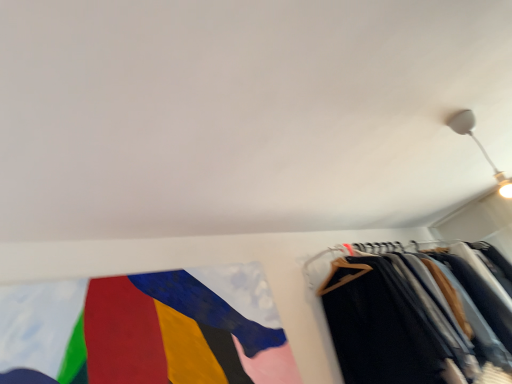
Question: Is point (478, 140) positioned closer to the camera than point (258, 329)?

Choices:
 (A) closer
 (B) farther

Answer: (B)

Question: In the image, is white glossy light fixture at upper right on the left side or the right side of textured fabric flag at lower left?

Choices:
 (A) left
 (B) right

Answer: (B)

Question: Estimate the real-world distances between objects in this image. Which object is farther from the white glossy light fixture at upper right?

Choices:
 (A) dark gray wool trousers at right
 (B) textured fabric flag at lower left

Answer: (B)

Question: Estimate the real-world distances between objects in this image. Which object is closer to the dark gray wool trousers at right?

Choices:
 (A) white glossy light fixture at upper right
 (B) textured fabric flag at lower left

Answer: (B)